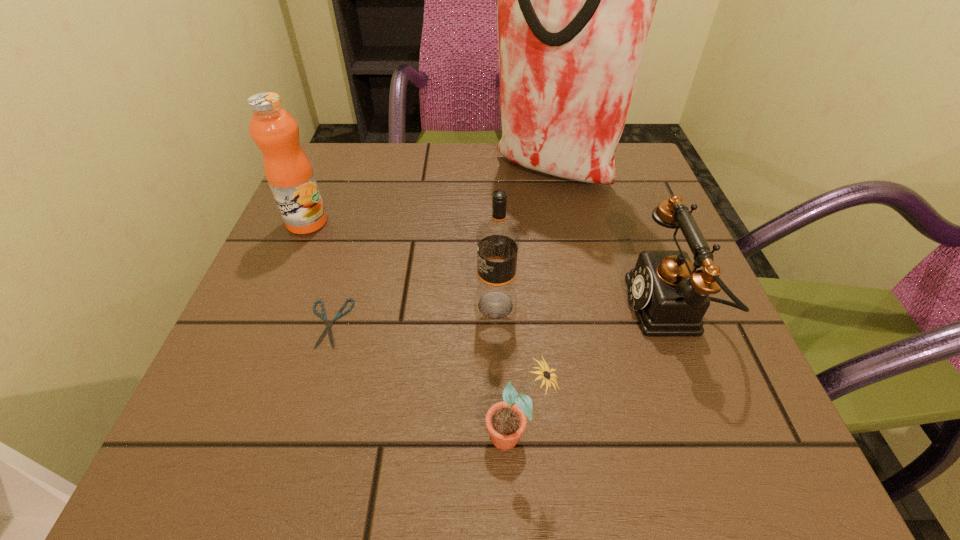
Where is `vacant space at the left edge`? vacant space at the left edge is located at coordinates (277, 251).

This screenshot has height=540, width=960. In the image, there is a desktop. Identify the location of vacant space at the right edge. (687, 249).

Find the location of `free point at the near left corner`. free point at the near left corner is located at coordinates (219, 466).

In the image, there is a desktop. Where is `free space at the near right corner`? free space at the near right corner is located at coordinates (692, 464).

The height and width of the screenshot is (540, 960). What are the coordinates of `empty location between the fifth nearest object and the vodka` in the screenshot? It's located at (401, 264).

Image resolution: width=960 pixels, height=540 pixels. Find the location of `free space that is in between the vodka and the nearest object`. free space that is in between the vodka and the nearest object is located at coordinates (506, 370).

Find the location of a particular element. Image resolution: width=960 pixels, height=540 pixels. free space between the fruit juice and the vodka is located at coordinates (401, 264).

Identify the location of vacant region between the fruit juice and the vodka. (401, 264).

I want to click on vacant space in between the fifth object from right to left and the farthest object, so click(439, 247).

Where is `blank region between the farthest object and the fifth object from right to left`? This screenshot has width=960, height=540. blank region between the farthest object and the fifth object from right to left is located at coordinates (439, 247).